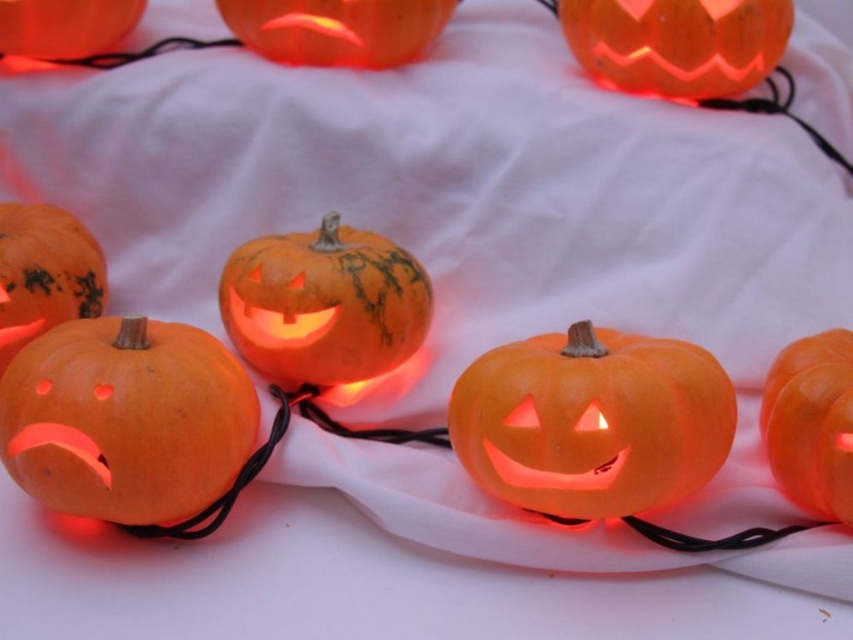
Is orange matte carved pumpkin at center to the right of matte orange pumpkin at left from the viewer's perspective?

Yes, orange matte carved pumpkin at center is to the right of matte orange pumpkin at left.

Can you confirm if orange matte carved pumpkin at center is positioned below matte orange pumpkin at left?

Correct, orange matte carved pumpkin at center is located below matte orange pumpkin at left.

In order to click on orange matte carved pumpkin at center in this screenshot , I will do `click(323, 305)`.

Consider the image. Which is more to the left, orange matte carved pumpkin at lower left or orange matte pumpkin at right?

orange matte carved pumpkin at lower left is more to the left.

Which of these two, orange matte carved pumpkin at lower left or orange matte pumpkin at right, stands shorter?

With less height is orange matte pumpkin at right.

You are a GUI agent. You are given a task and a screenshot of the screen. Output one action in this format:
    pyautogui.click(x=<x>, y=<y>)
    Task: Click on the orange matte carved pumpkin at lower left
    
    Given the screenshot: What is the action you would take?
    pyautogui.click(x=126, y=419)

Is orange matte carved pumpkin at upper right to the right of orange matte pumpkin at right from the viewer's perspective?

In fact, orange matte carved pumpkin at upper right is to the left of orange matte pumpkin at right.

Does point (726, 83) come farther from viewer compared to point (782, 438)?

Yes, point (726, 83) is behind point (782, 438).

At what (x,y) coordinates should I click in order to perform the action: click on orange matte carved pumpkin at upper right. Please return your answer as a coordinate pair (x, y). The width and height of the screenshot is (853, 640). Looking at the image, I should click on (677, 42).